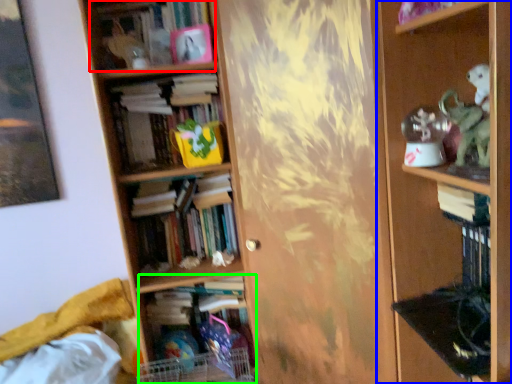
Question: Which is nearer to the book (highlighted by a red box)? shelf (highlighted by a blue box) or book (highlighted by a green box).

Choices:
 (A) shelf
 (B) book

Answer: (A)